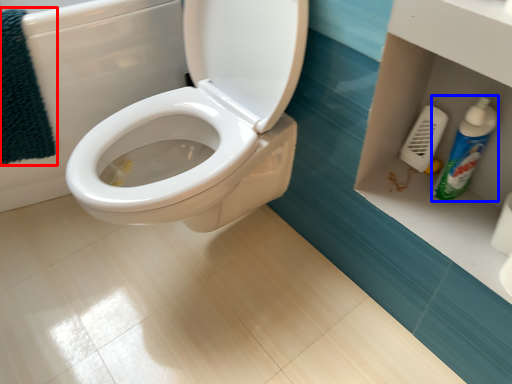
Question: Which object appears closest to the camera in this image, bath towel (highlighted by a red box) or cleaning product (highlighted by a blue box)?

Choices:
 (A) bath towel
 (B) cleaning product

Answer: (B)